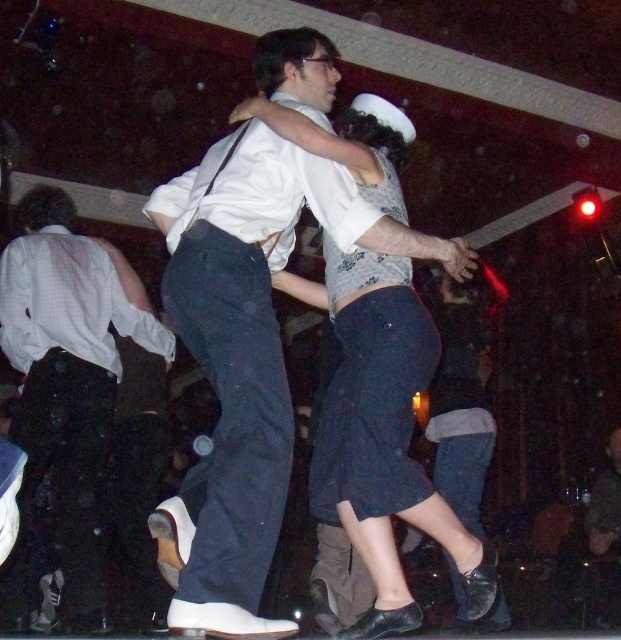
Question: Which of the following is the closest to the observer?

Choices:
 (A) white matte shirt at center
 (B) matte black pants at center

Answer: (A)

Question: Is white matte shirt at center closer to camera compared to matte black pants at center?

Choices:
 (A) no
 (B) yes

Answer: (B)

Question: Is white matte shirt at center smaller than matte black pants at center?

Choices:
 (A) no
 (B) yes

Answer: (A)

Question: Considering the relative positions of white matte shirt at center and matte black pants at center in the image provided, where is white matte shirt at center located with respect to matte black pants at center?

Choices:
 (A) above
 (B) below

Answer: (A)